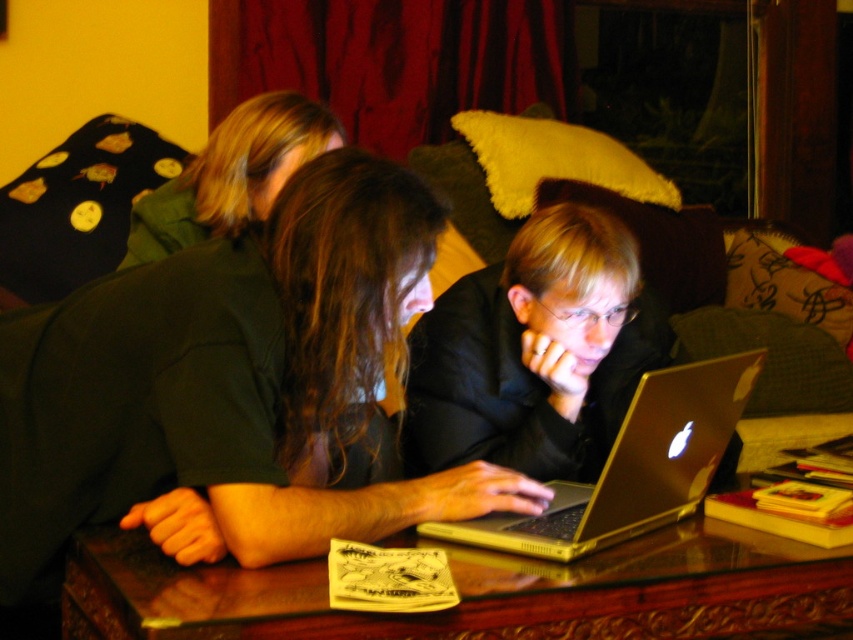
You are standing in front of the table and want to place a new object exactly where the metallic gold laptop at center is currently located. What are the coordinates you should aim for?

The coordinates for the metallic gold laptop at center are at point [631,467], so you should aim for those coordinates.

You are a delivery person who needs to place a small package between the velvet green couch at center and the dark green shirt at center. The package is 10 inches long. Is there enough space between them to fit the package?

The velvet green couch at center is 21.91 inches away from the dark green shirt at center. Since the package is 10 inches long, there is sufficient space to place it between them.